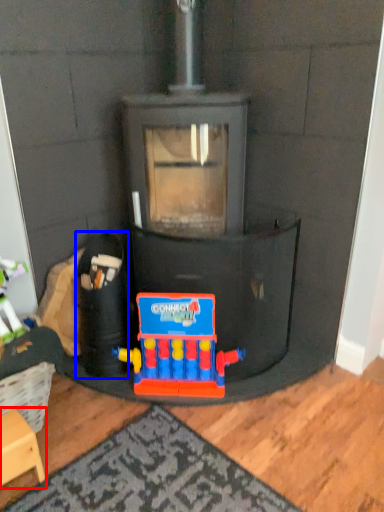
Question: Among these objects, which one is farthest to the camera, furniture (highlighted by a red box) or toy (highlighted by a blue box)?

Choices:
 (A) furniture
 (B) toy

Answer: (B)